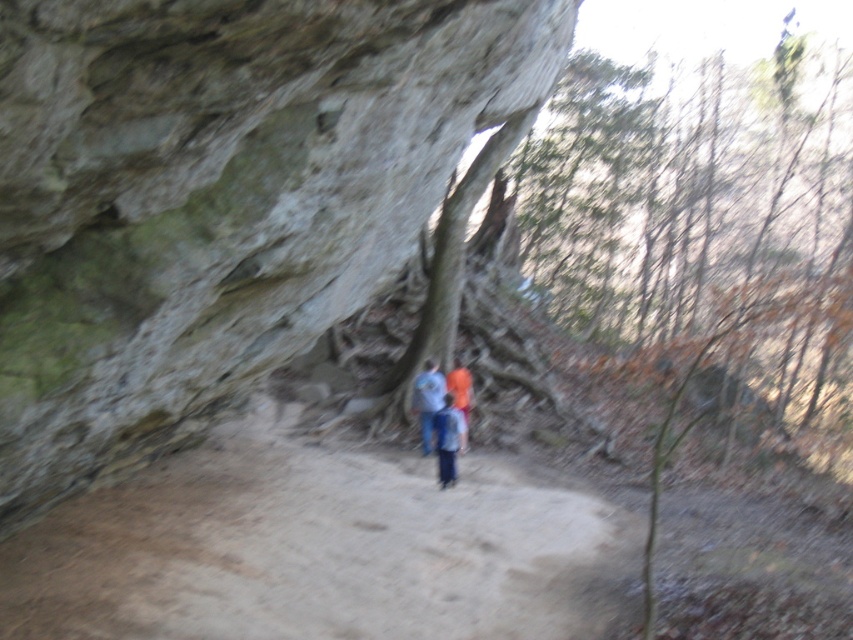
Does gray rough rock at center have a smaller size compared to dirt path at center?

Incorrect, gray rough rock at center is not smaller in size than dirt path at center.

Which is in front, point (213, 218) or point (480, 528)?

Positioned in front is point (213, 218).

Find the location of `gray rough rock at center`. gray rough rock at center is located at coordinates (216, 196).

Is the position of dirt path at center more distant than that of blue fabric shirt at center?

No, it is not.

Who is lower down, dirt path at center or blue fabric shirt at center?

dirt path at center is lower down.

Is point (148, 636) positioned in front of point (421, 372)?

Yes, it is in front of point (421, 372).

Where is `dirt path at center`? This screenshot has height=640, width=853. dirt path at center is located at coordinates (318, 550).

Which of these two, gray rough rock at center or blue denim jeans at center, stands shorter?

blue denim jeans at center

The height and width of the screenshot is (640, 853). In order to click on gray rough rock at center in this screenshot , I will do `click(216, 196)`.

The image size is (853, 640). I want to click on gray rough rock at center, so click(x=216, y=196).